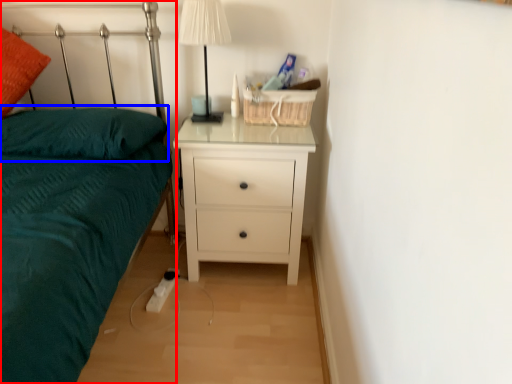
Question: Among these objects, which one is nearest to the camera, bed (highlighted by a red box) or pillow (highlighted by a blue box)?

Choices:
 (A) bed
 (B) pillow

Answer: (A)